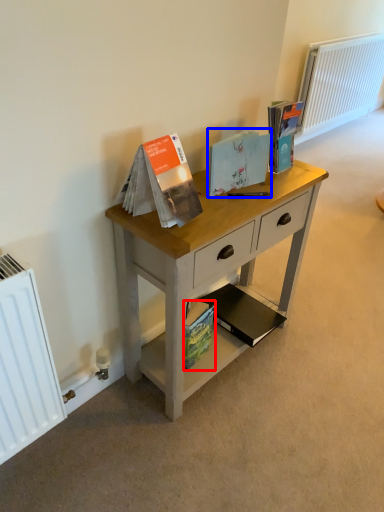
Question: Which object is further to the camera taking this photo, paperback book (highlighted by a red box) or paperback book (highlighted by a blue box)?

Choices:
 (A) paperback book
 (B) paperback book

Answer: (A)